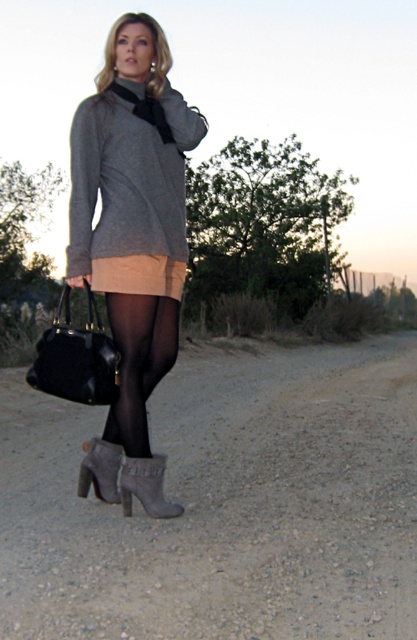
You are a fashion photographer analyzing the outfit of a model in a photo. You notice the black sheer tights at lower center and the suede gray boot at lower center. Which of these two items is positioned more to the right in the image?

Answer: The black sheer tights at lower center are positioned more to the right than the suede gray boot at lower center.

You are a photographer trying to capture the woman in the image. You want to focus on her black sheer tights at lower center. Where exactly should you aim your camera to capture them?

You should aim your camera at point 0.567 on the horizontal axis and 0.333 on the vertical axis to capture the black sheer tights at lower center.